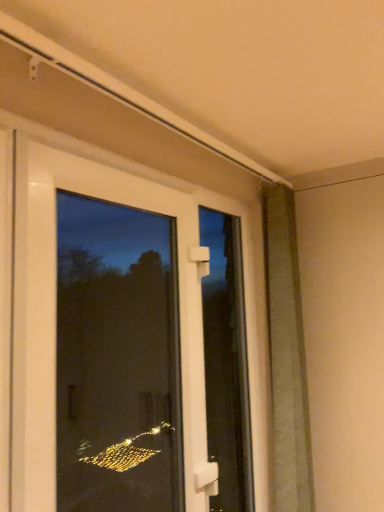
Identify the location of white plastic door at center. (54, 295).

I want to click on green textured curtain at right, so click(x=286, y=355).

Considering the relative positions of white plastic handle at center and green textured curtain at right in the image provided, is white plastic handle at center to the left or to the right of green textured curtain at right?

In the image, white plastic handle at center appears on the left side of green textured curtain at right.

Which is behind, point (235, 313) or point (280, 446)?

The point (235, 313) is farther.

Is green textured curtain at right located within white plastic handle at center?

That's incorrect, green textured curtain at right is not inside white plastic handle at center.

Which is in front, green textured curtain at right or white plastic door at center?

white plastic door at center is closer to the camera.

Between green textured curtain at right and white plastic door at center, which one has less height?

white plastic door at center.

What's the angular difference between green textured curtain at right and white plastic door at center's facing directions?

0.0521 degrees.

From the image's perspective, is green textured curtain at right located beneath white plastic handle at center?

No.

Is green textured curtain at right looking in the opposite direction of white plastic handle at center?

That's not correct — green textured curtain at right is not looking away from white plastic handle at center.

The height and width of the screenshot is (512, 384). What are the coordinates of `screen door that appears in front of the green textured curtain at right` in the screenshot? It's located at (226, 362).

Which object is closer to the camera taking this photo, white plastic door at center or green textured curtain at right?

white plastic door at center is in front.

The height and width of the screenshot is (512, 384). I want to click on door in front of the green textured curtain at right, so click(54, 295).

Based on the photo, from the image's perspective, is white plastic door at center above or below green textured curtain at right?

white plastic door at center is above green textured curtain at right.

Between white plastic handle at center and white plastic door at center, which one has smaller size?

Smaller between the two is white plastic handle at center.

Between white plastic handle at center and white plastic door at center, which one has less height?

Standing shorter between the two is white plastic door at center.

Identify the location of screen door located underneath the white plastic door at center (from a real-world perspective). (226, 362).

Is white plastic handle at center oriented towards white plastic door at center?

No.

Can we say white plastic door at center lies outside white plastic handle at center?

white plastic door at center lies outside white plastic handle at center's area.

Can you tell me how much white plastic door at center and white plastic handle at center differ in facing direction?

0.0182 degrees separate the facing orientations of white plastic door at center and white plastic handle at center.

Does white plastic door at center have a greater height compared to white plastic handle at center?

No, white plastic door at center is not taller than white plastic handle at center.

The height and width of the screenshot is (512, 384). I want to click on screen door on the left of the green textured curtain at right, so click(226, 362).

This screenshot has height=512, width=384. Identify the location of shutter on the right of white plastic door at center. [x=286, y=355].

Which object lies nearer to the anchor point white plastic door at center, green textured curtain at right or white plastic handle at center?

white plastic handle at center is positioned closer to the anchor white plastic door at center.

Which object lies further to the anchor point white plastic door at center, white plastic handle at center or green textured curtain at right?

Based on the image, green textured curtain at right appears to be further to white plastic door at center.

Which object lies nearer to the anchor point green textured curtain at right, white plastic door at center or white plastic handle at center?

white plastic handle at center lies closer to green textured curtain at right than the other object.

Looking at the image, which one is located closer to green textured curtain at right, white plastic handle at center or white plastic door at center?

The object closer to green textured curtain at right is white plastic handle at center.

When comparing their distances from white plastic handle at center, does white plastic door at center or green textured curtain at right seem closer?

Based on the image, green textured curtain at right appears to be nearer to white plastic handle at center.

When comparing their distances from white plastic handle at center, does green textured curtain at right or white plastic door at center seem closer?

Based on the image, green textured curtain at right appears to be nearer to white plastic handle at center.

At what (x,y) coordinates should I click in order to perform the action: click on screen door between white plastic door at center and green textured curtain at right in the front-back direction. Please return your answer as a coordinate pair (x, y). This screenshot has height=512, width=384. Looking at the image, I should click on (226, 362).